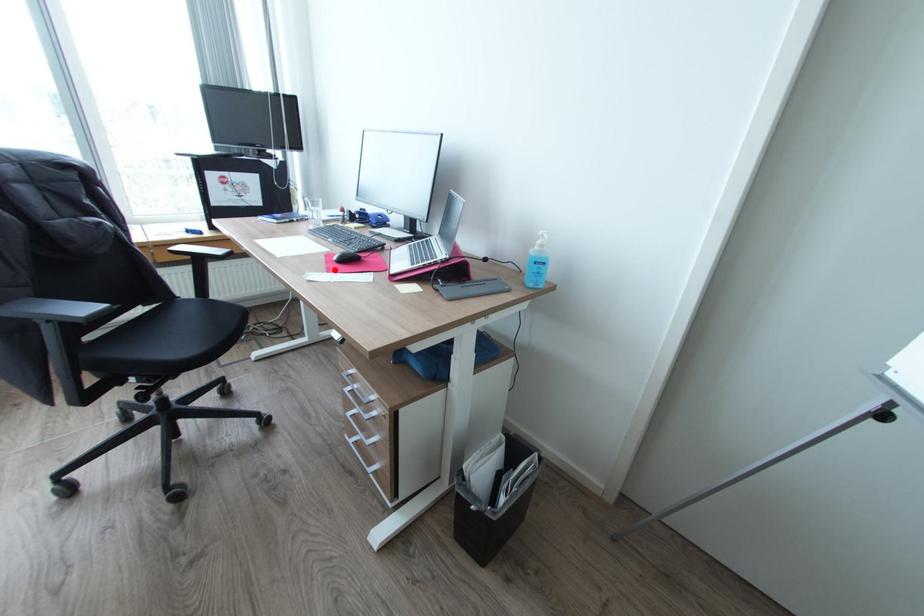
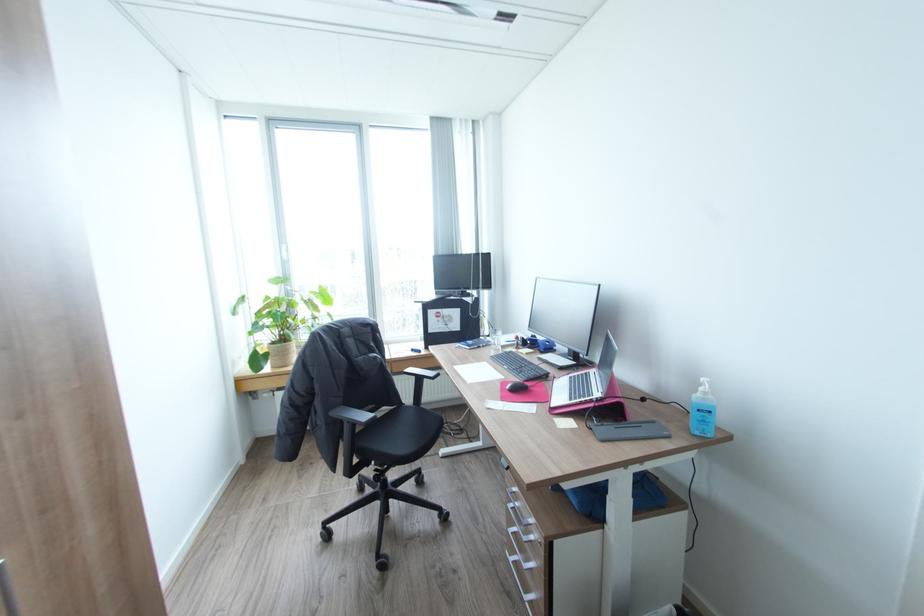
The point at the highlighted location is marked in the first image. Where is the corresponding point in the second image?

(507, 399)